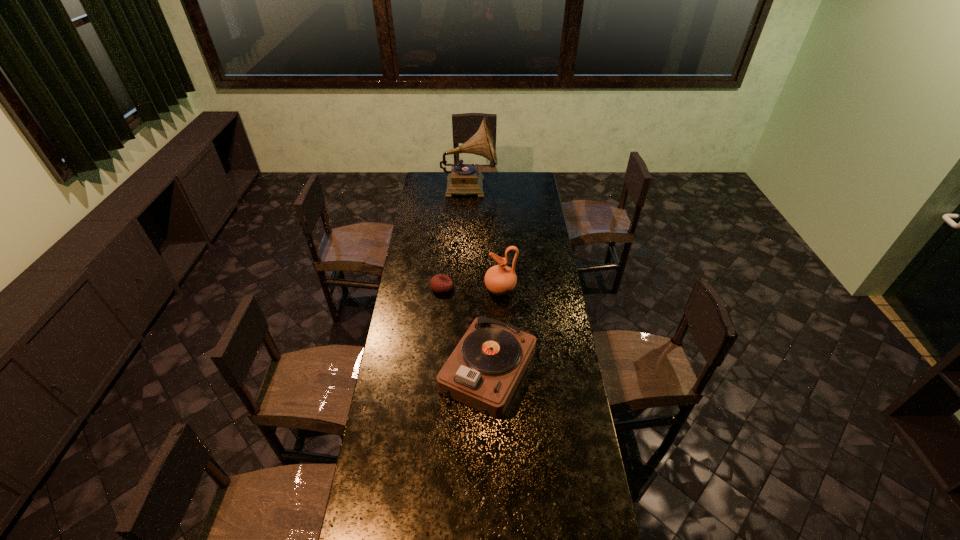
Find the location of a particular element. This screenshot has width=960, height=540. the taller record player is located at coordinates (464, 179).

Locate an element on the screen. The width and height of the screenshot is (960, 540). the farther record player is located at coordinates (464, 179).

Locate an element on the screen. This screenshot has height=540, width=960. the third shortest object is located at coordinates (500, 279).

At what (x,y) coordinates should I click in order to perform the action: click on the nearer record player. Please return your answer as a coordinate pair (x, y). Looking at the image, I should click on (484, 370).

You are a GUI agent. You are given a task and a screenshot of the screen. Output one action in this format:
    pyautogui.click(x=<x>, y=<y>)
    Task: Click on the shorter record player
    The width and height of the screenshot is (960, 540).
    Given the screenshot: What is the action you would take?
    pyautogui.click(x=484, y=370)

The height and width of the screenshot is (540, 960). What are the coordinates of `beanbag` in the screenshot? It's located at (440, 283).

Where is `free space located 0.070m from the horn of the farther record player`? The image size is (960, 540). free space located 0.070m from the horn of the farther record player is located at coordinates (508, 186).

I want to click on vacant space positioned 0.120m on the spout of the second tallest object, so [460, 289].

Locate an element on the screen. free space located 0.060m on the spout of the second tallest object is located at coordinates (472, 289).

The width and height of the screenshot is (960, 540). I want to click on free space located on the spout of the second tallest object, so click(x=454, y=289).